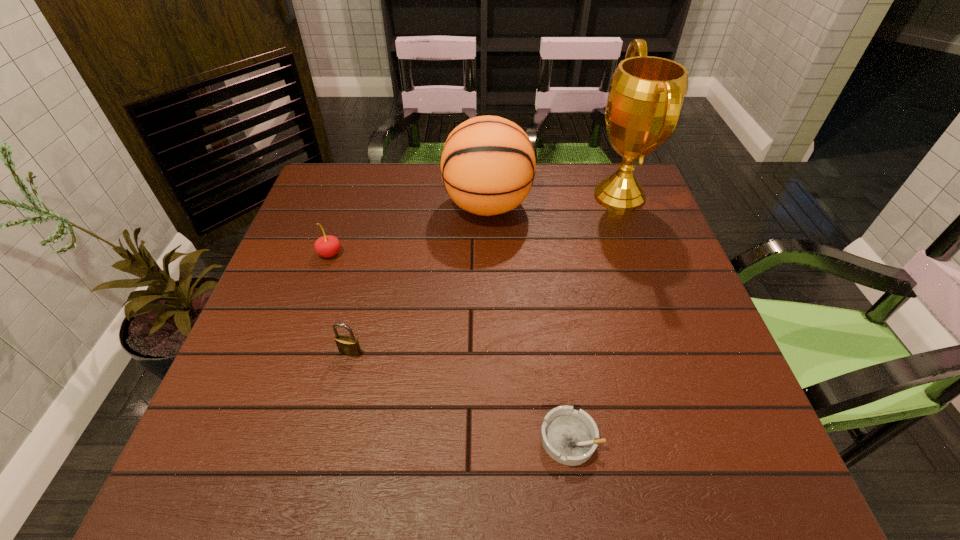
Locate an element on the screen. The image size is (960, 540). free space located 0.170m on the front-facing side of the tallest object is located at coordinates (531, 196).

What are the coordinates of `vacant position located 0.180m on the front-facing side of the tallest object` in the screenshot? It's located at (528, 196).

At what (x,y) coordinates should I click in order to perform the action: click on vacant area situated on the back of the second tallest object. Please return your answer as a coordinate pair (x, y). Looking at the image, I should click on tap(487, 168).

Find the location of a particular element. The height and width of the screenshot is (540, 960). free region located on the right of the cherry is located at coordinates (462, 254).

Where is `vacant region located 0.100m on the back of the fourth farthest object`? vacant region located 0.100m on the back of the fourth farthest object is located at coordinates (361, 312).

Identify the location of vacant space situated 0.090m on the left of the shortest object. (491, 438).

The height and width of the screenshot is (540, 960). I want to click on award at the far edge, so click(646, 94).

Locate an element on the screen. The height and width of the screenshot is (540, 960). basketball situated at the far edge is located at coordinates (488, 165).

You are a GUI agent. You are given a task and a screenshot of the screen. Output one action in this format:
    pyautogui.click(x=<x>, y=<y>)
    Task: Click on the object that is positioned at the near edge
    The width and height of the screenshot is (960, 540).
    Given the screenshot: What is the action you would take?
    pyautogui.click(x=570, y=437)

You are a GUI agent. You are given a task and a screenshot of the screen. Output one action in this format:
    pyautogui.click(x=<x>, y=<y>)
    Task: Click on the object present at the left edge
    The height and width of the screenshot is (540, 960).
    Given the screenshot: What is the action you would take?
    pyautogui.click(x=326, y=246)